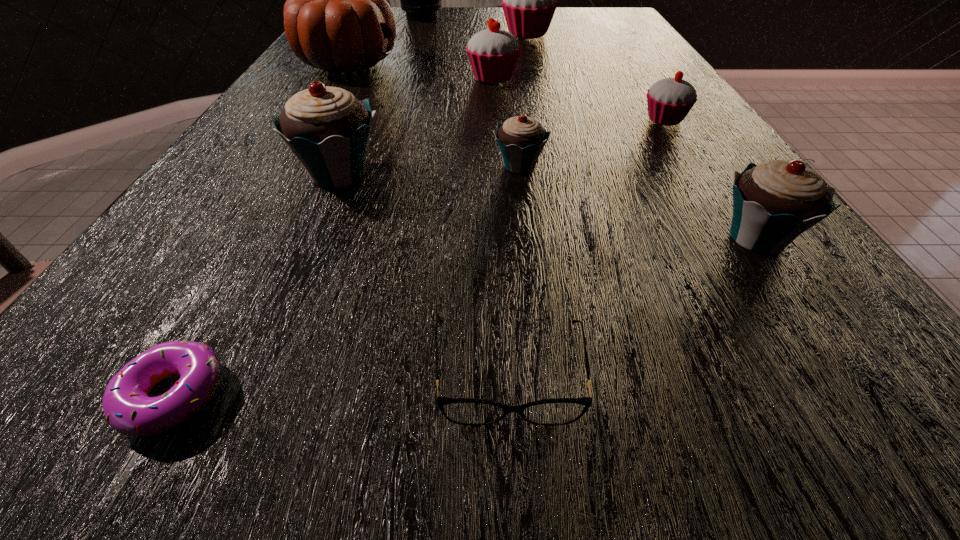
Identify the location of free space located 0.140m on the right of the biggest teal cupcake. This screenshot has width=960, height=540. (x=474, y=174).

What are the coordinates of `blank space located on the front of the second nearest pink cupcake` in the screenshot? It's located at (496, 151).

The height and width of the screenshot is (540, 960). I want to click on free space located 0.350m on the left of the eighth farthest object, so click(x=449, y=238).

Find the location of a particular element. The height and width of the screenshot is (540, 960). vacant space situated on the front of the fourth nearest cupcake is located at coordinates (720, 206).

Image resolution: width=960 pixels, height=540 pixels. Find the location of `vacant area located 0.320m on the left of the second teal cupcake from right to left`. vacant area located 0.320m on the left of the second teal cupcake from right to left is located at coordinates (296, 166).

The height and width of the screenshot is (540, 960). Identify the location of vacant space located 0.070m on the left of the pink doughnut. (52, 395).

At what (x,y) coordinates should I click in order to perform the action: click on telephoto lens that is at the far edge. Please return your answer as a coordinate pair (x, y). Image resolution: width=960 pixels, height=540 pixels. Looking at the image, I should click on (421, 0).

Where is `cupcake situated at the far edge`? cupcake situated at the far edge is located at coordinates (529, 0).

This screenshot has width=960, height=540. What are the coordinates of `spectacles present at the near edge` in the screenshot? It's located at coord(464,411).

Locate an element on the screen. Image resolution: width=960 pixels, height=540 pixels. doughnut that is positioned at the near edge is located at coordinates (127, 408).